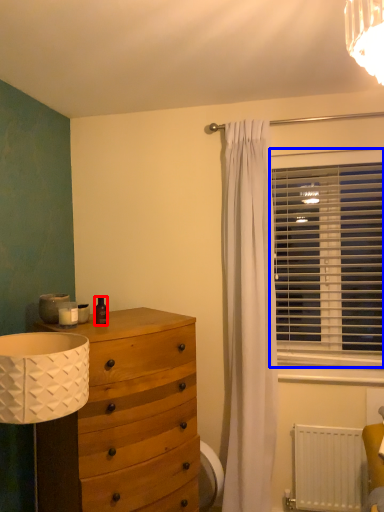
Question: Which point is closer to the camera, toiletry (highlighted by a red box) or window blind (highlighted by a blue box)?

Choices:
 (A) toiletry
 (B) window blind

Answer: (A)